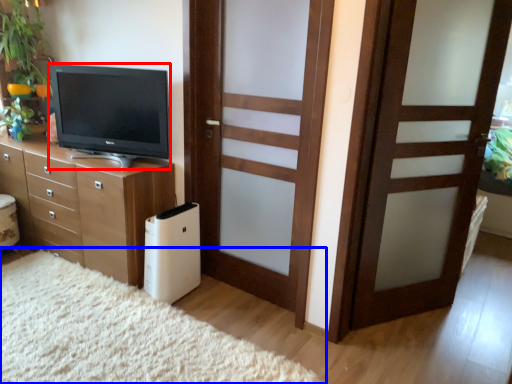
Question: Which point is closer to the camera, television (highlighted by a red box) or plain (highlighted by a blue box)?

Choices:
 (A) television
 (B) plain

Answer: (B)